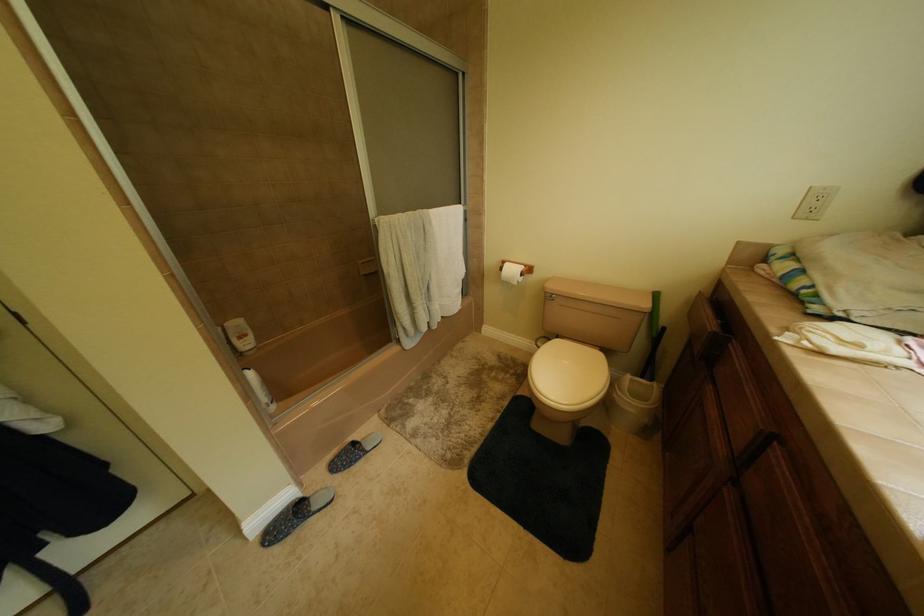
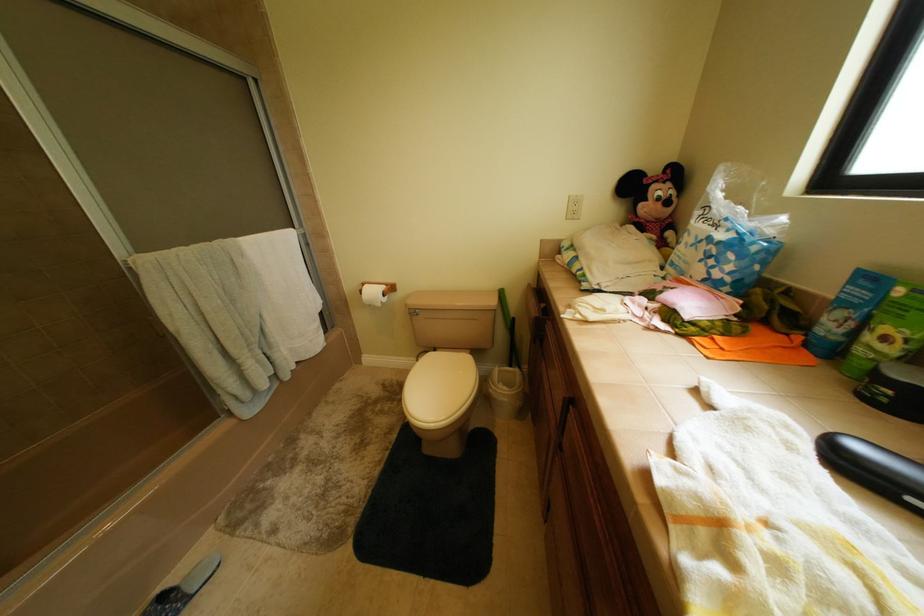
Question: The camera is either moving clockwise (left) or counter-clockwise (right) around the object. The first image is from the beginning of the video and the second image is from the end. Is the camera moving left or right when shooting the video?

Choices:
 (A) Left
 (B) Right

Answer: (A)